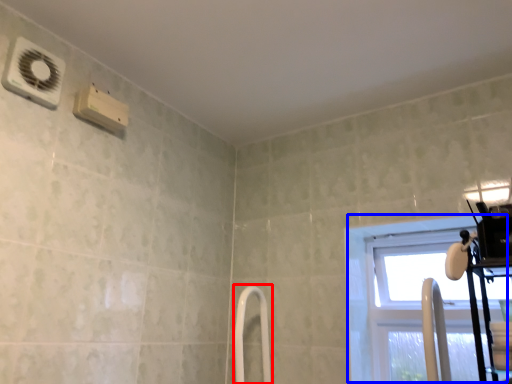
Question: Which of the following is the closest to the observer, shower door (highlighted by a red box) or window (highlighted by a blue box)?

Choices:
 (A) shower door
 (B) window

Answer: (B)